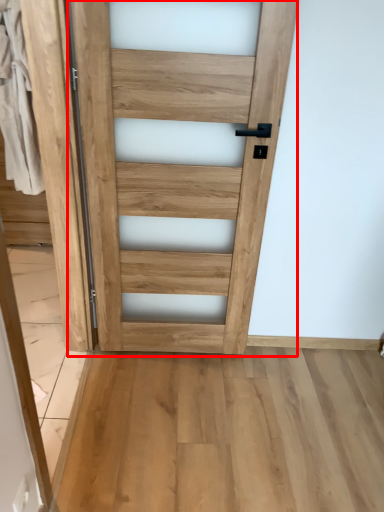
Question: Where is door (annotated by the red box) located in relation to barn door in the image?

Choices:
 (A) left
 (B) right

Answer: (B)